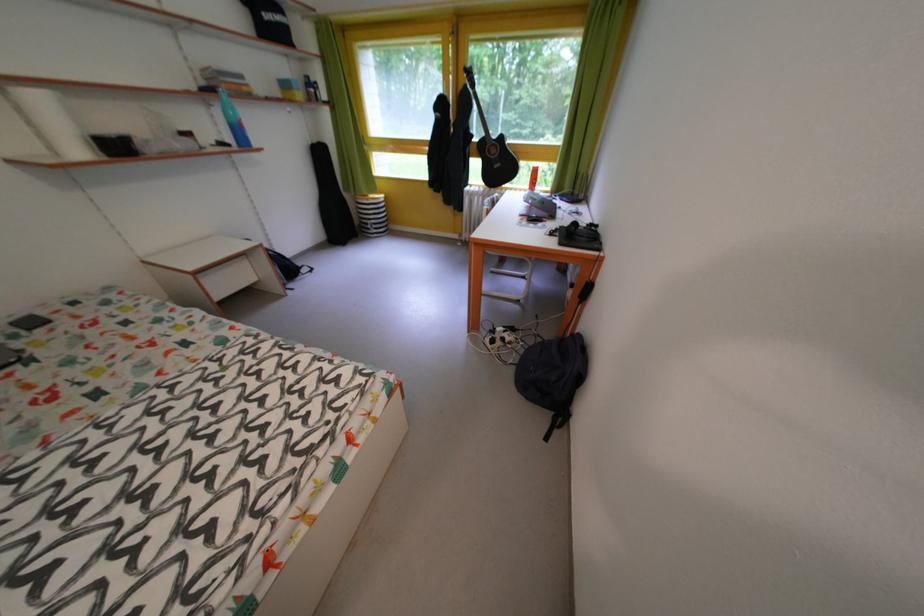
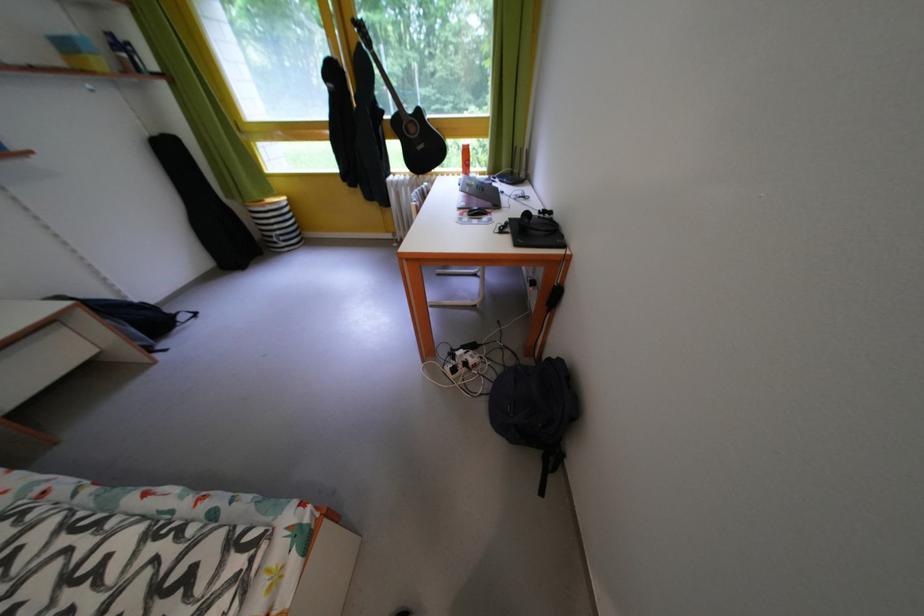
Find the pixel in the second image that matches point 513,345 in the first image.

(476, 370)